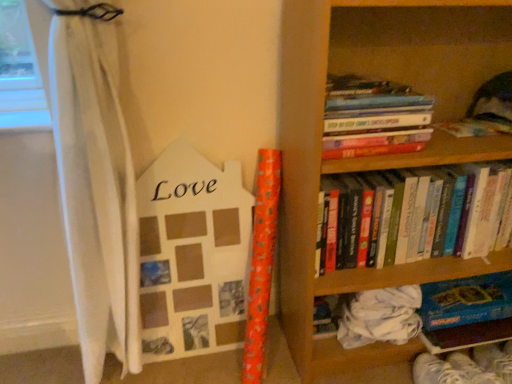
Question: Is hardcover books at upper right, positioned as the 2th book in bottom-to-top order, at the right side of wooden photo frame at left?

Choices:
 (A) yes
 (B) no

Answer: (A)

Question: Is hardcover books at upper right, positioned as the 2th book in bottom-to-top order, closer to the viewer compared to wooden photo frame at left?

Choices:
 (A) no
 (B) yes

Answer: (B)

Question: Does hardcover books at upper right, which is the second book in top-to-bottom order, have a smaller size compared to wooden photo frame at left?

Choices:
 (A) yes
 (B) no

Answer: (B)

Question: Would you consider hardcover books at upper right, positioned as the 2th book in bottom-to-top order, to be distant from wooden photo frame at left?

Choices:
 (A) no
 (B) yes

Answer: (A)

Question: From a real-world perspective, is hardcover books at upper right, which is the second book in top-to-bottom order, located higher than wooden photo frame at left?

Choices:
 (A) no
 (B) yes

Answer: (B)

Question: From the image's perspective, relative to hardcover books at upper right, arranged as the 3th book when ordered from the bottom, is wooden photo frame at left above or below?

Choices:
 (A) above
 (B) below

Answer: (B)

Question: Do you think wooden photo frame at left is within hardcover books at upper right, arranged as the 3th book when ordered from the bottom, or outside of it?

Choices:
 (A) inside
 (B) outside

Answer: (B)

Question: In terms of height, does wooden photo frame at left look taller or shorter compared to hardcover books at upper right, arranged as the 3th book when ordered from the bottom?

Choices:
 (A) short
 (B) tall

Answer: (B)

Question: From a real-world perspective, is wooden photo frame at left above or below hardcover books at upper right, arranged as the 3th book when ordered from the bottom?

Choices:
 (A) below
 (B) above

Answer: (A)

Question: Is wooden photo frame at left in front of or behind wooden bookcase at right in the image?

Choices:
 (A) front
 (B) behind

Answer: (B)

Question: From a real-world perspective, relative to wooden bookcase at right, is wooden photo frame at left vertically above or below?

Choices:
 (A) above
 (B) below

Answer: (B)

Question: Is point (216, 350) positioned closer to the camera than point (311, 238)?

Choices:
 (A) closer
 (B) farther

Answer: (B)

Question: Is wooden photo frame at left to the left or to the right of wooden bookcase at right in the image?

Choices:
 (A) right
 (B) left

Answer: (B)

Question: Does point (445, 342) appear closer or farther from the camera than point (428, 132)?

Choices:
 (A) closer
 (B) farther

Answer: (B)

Question: In terms of height, does blue cardboard book at lower right, which appears as the 1th book when ordered from the bottom, look taller or shorter compared to hardcover books at upper right, which is counted as the first book, starting from the top?

Choices:
 (A) tall
 (B) short

Answer: (B)